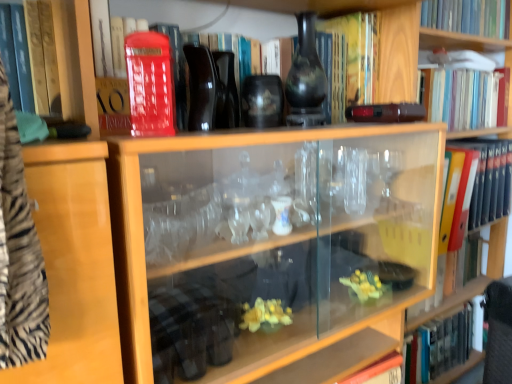
Question: Is matte red phone box at upper left not within hardcover book at lower right, placed as the first book when sorted from bottom to top?

Choices:
 (A) no
 (B) yes

Answer: (B)

Question: From a real-world perspective, is matte red phone box at upper left under hardcover book at lower right, which is the sixth book from top to bottom?

Choices:
 (A) yes
 (B) no

Answer: (B)

Question: Does matte red phone box at upper left have a lesser height compared to hardcover book at lower right, which is the sixth book from top to bottom?

Choices:
 (A) yes
 (B) no

Answer: (A)

Question: Is matte red phone box at upper left beside hardcover book at lower right, placed as the first book when sorted from bottom to top?

Choices:
 (A) yes
 (B) no

Answer: (B)

Question: Is matte red phone box at upper left at the left side of hardcover book at lower right, which is the sixth book from top to bottom?

Choices:
 (A) yes
 (B) no

Answer: (A)

Question: From the image's perspective, does matte red phone box at upper left appear higher than hardcover book at lower right, which is the sixth book from top to bottom?

Choices:
 (A) no
 (B) yes

Answer: (B)

Question: Does hardcover book at upper right, the 1th book from the top, appear on the right side of matte black vase at upper center?

Choices:
 (A) no
 (B) yes

Answer: (B)

Question: Does hardcover book at upper right, the 6th book from the bottom, have a smaller size compared to matte black vase at upper center?

Choices:
 (A) no
 (B) yes

Answer: (A)

Question: From a real-world perspective, is hardcover book at upper right, the 1th book from the top, located higher than matte black vase at upper center?

Choices:
 (A) no
 (B) yes

Answer: (B)

Question: From the image's perspective, would you say hardcover book at upper right, the 1th book from the top, is positioned over matte black vase at upper center?

Choices:
 (A) yes
 (B) no

Answer: (A)

Question: Is hardcover book at upper right, the 1th book from the top, taller than matte black vase at upper center?

Choices:
 (A) no
 (B) yes

Answer: (A)

Question: Does hardcover book at upper right, the 1th book from the top, have a lesser height compared to matte black vase at upper center?

Choices:
 (A) no
 (B) yes

Answer: (B)

Question: Is matte red book at upper center, acting as the 4th book starting from the top, wider than matte red phone box at upper left?

Choices:
 (A) no
 (B) yes

Answer: (B)